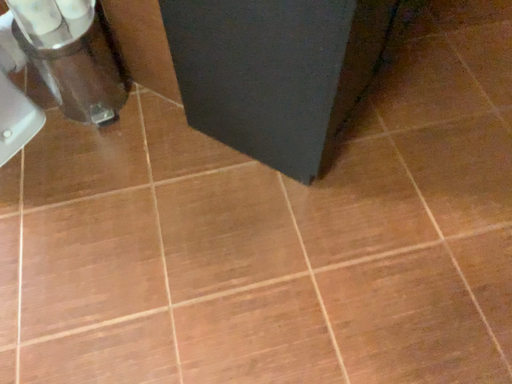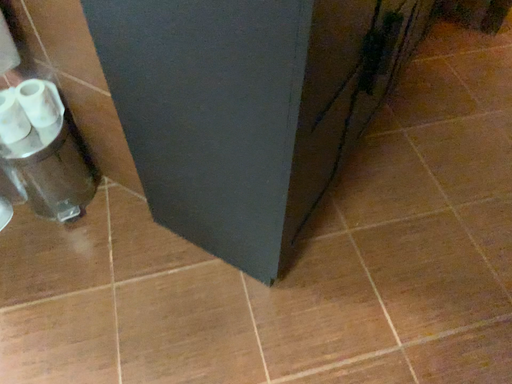
Question: How did the camera likely rotate when shooting the video?

Choices:
 (A) rotated upward
 (B) rotated downward

Answer: (A)